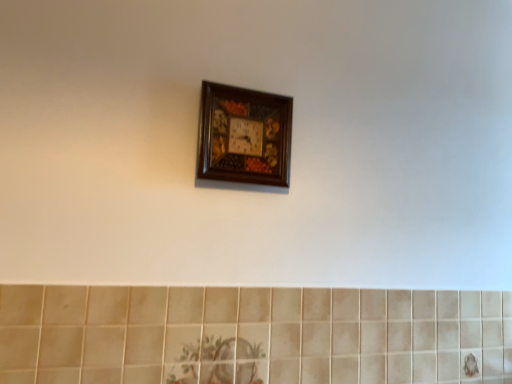
Question: From a real-world perspective, relative to wooden clock at upper center, is beige ceramic tile at lower center vertically above or below?

Choices:
 (A) below
 (B) above

Answer: (A)

Question: From the image's perspective, relative to wooden clock at upper center, is beige ceramic tile at lower center above or below?

Choices:
 (A) below
 (B) above

Answer: (A)

Question: Is beige ceramic tile at lower center in front of or behind wooden clock at upper center in the image?

Choices:
 (A) front
 (B) behind

Answer: (A)

Question: Is wooden clock at upper center taller or shorter than beige ceramic tile at lower center?

Choices:
 (A) tall
 (B) short

Answer: (B)

Question: From the image's perspective, is wooden clock at upper center located above or below beige ceramic tile at lower center?

Choices:
 (A) below
 (B) above

Answer: (B)

Question: Considering the positions of wooden clock at upper center and beige ceramic tile at lower center in the image, is wooden clock at upper center wider or thinner than beige ceramic tile at lower center?

Choices:
 (A) thin
 (B) wide

Answer: (B)

Question: Looking at the image, does wooden clock at upper center seem bigger or smaller compared to beige ceramic tile at lower center?

Choices:
 (A) small
 (B) big

Answer: (A)